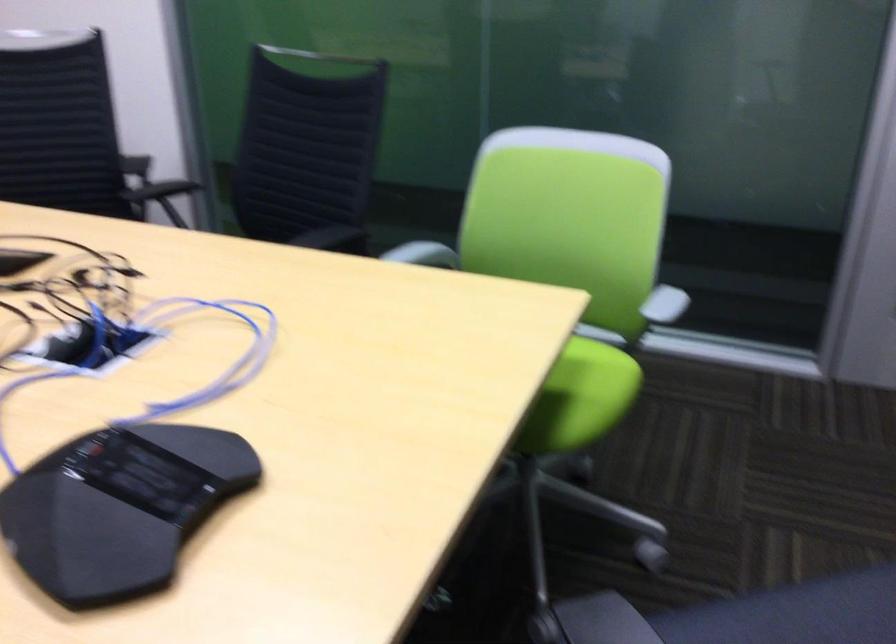
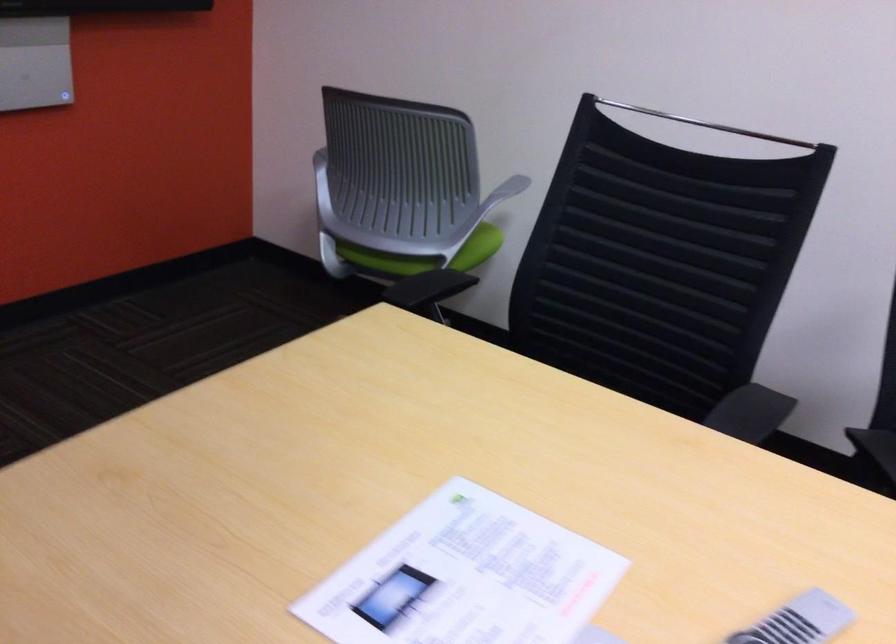
What movement of the cameraman would produce the second image?

The cameraman walked toward left, forward.